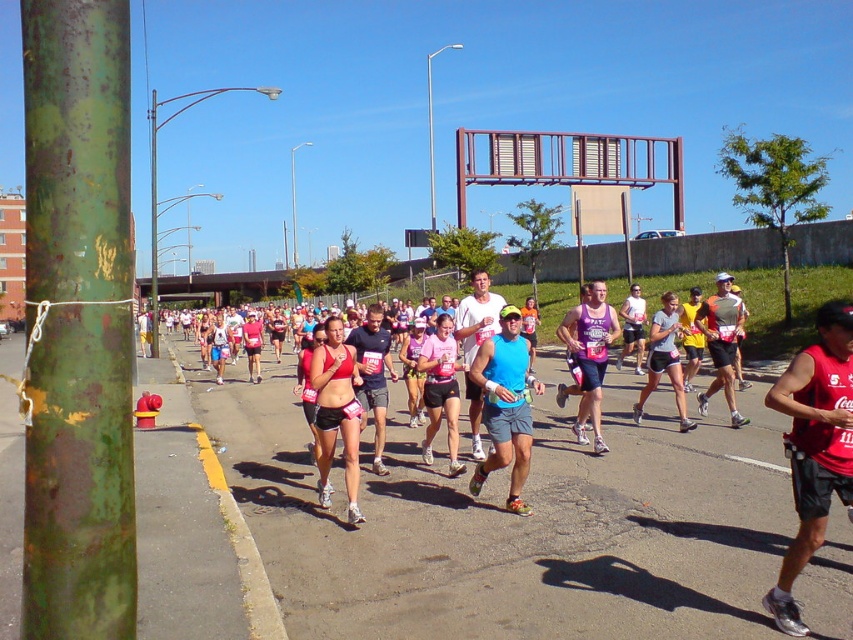
Does green rusted pole at left appear under matte red sports bra at center?

No, green rusted pole at left is not below matte red sports bra at center.

Who is taller, green rusted pole at left or matte red sports bra at center?

green rusted pole at left

Where is `green rusted pole at left`? The width and height of the screenshot is (853, 640). green rusted pole at left is located at coordinates (78, 323).

In the scene shown: Between green rusted pole at left and red fabric tank top at center-right, which one is positioned lower?

Positioned lower is red fabric tank top at center-right.

Which of these two, green rusted pole at left or red fabric tank top at center-right, stands taller?

green rusted pole at left is taller.

Who is more distant from viewer, (39,10) or (819,474)?

The point (819,474) is more distant.

Identify the location of green rusted pole at left. (78, 323).

Between red fabric tank top at center-right and matte red sports bra at center, which one appears on the left side from the viewer's perspective?

matte red sports bra at center

Can you confirm if red fabric tank top at center-right is bigger than matte red sports bra at center?

No.

Is point (798, 628) behind point (328, 336)?

No, (798, 628) is closer to viewer.

Find the location of a particular element. Image resolution: width=853 pixels, height=640 pixels. red fabric tank top at center-right is located at coordinates (814, 445).